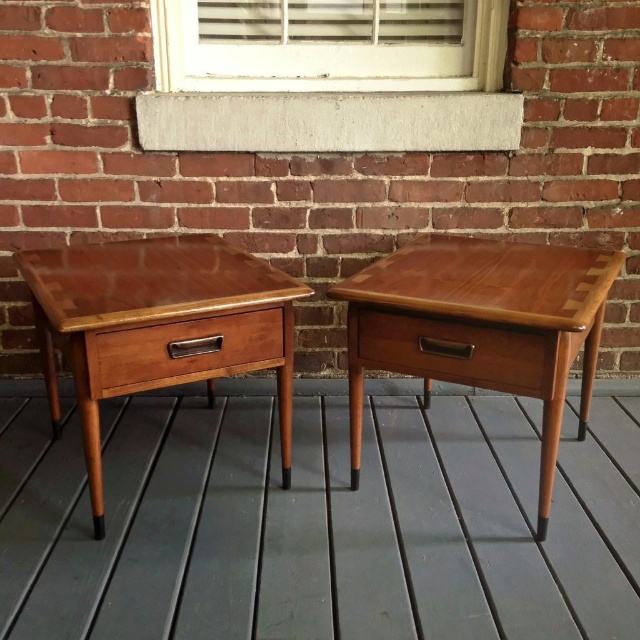
Question: Which point is closer to the camera?

Choices:
 (A) teak wood deck at center
 (B) matte wood drawer at center
 (C) wooden drawer at left

Answer: (A)

Question: Estimate the real-world distances between objects in this image. Which object is farther from the wooden drawer at left?

Choices:
 (A) matte wood drawer at center
 (B) mahogany wood side table at center
 (C) mahogany wood table at left
 (D) teak wood deck at center

Answer: (D)

Question: Which object is the closest to the wooden drawer at left?

Choices:
 (A) teak wood deck at center
 (B) mahogany wood side table at center
 (C) mahogany wood table at left

Answer: (C)

Question: Does teak wood deck at center appear under matte wood drawer at center?

Choices:
 (A) no
 (B) yes

Answer: (B)

Question: Can you confirm if teak wood deck at center is thinner than wooden drawer at left?

Choices:
 (A) yes
 (B) no

Answer: (B)

Question: Does mahogany wood table at left have a greater width compared to wooden drawer at left?

Choices:
 (A) no
 (B) yes

Answer: (B)